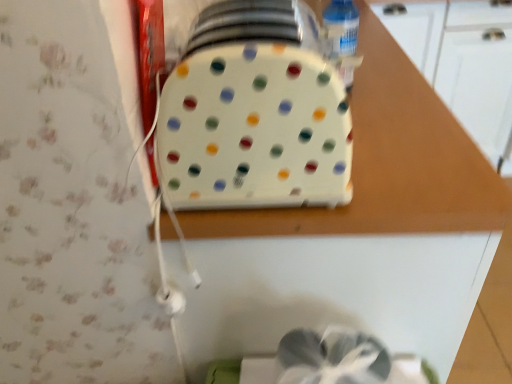
This screenshot has height=384, width=512. Find the location of `free spot in front of clear plastic bottle at upper right`. free spot in front of clear plastic bottle at upper right is located at coordinates (390, 125).